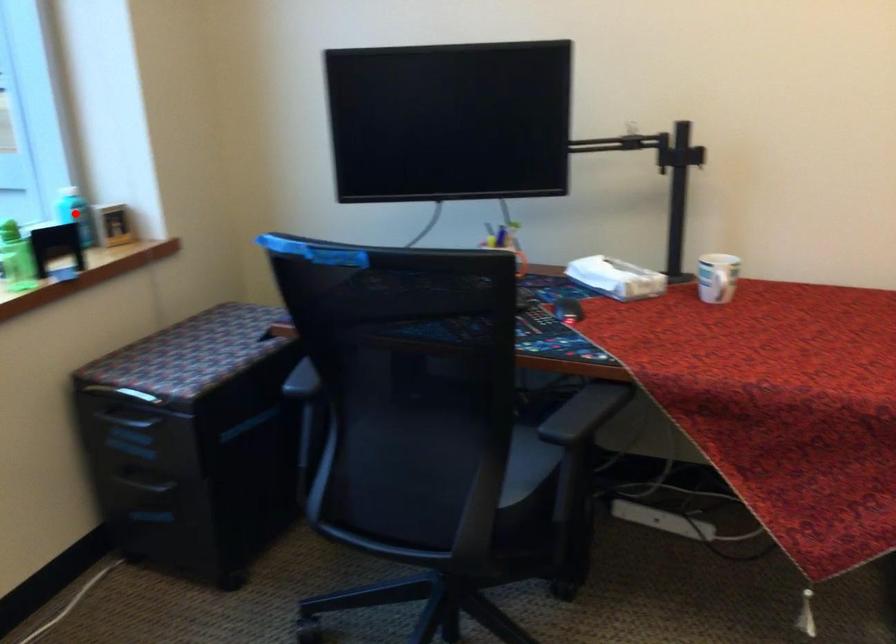
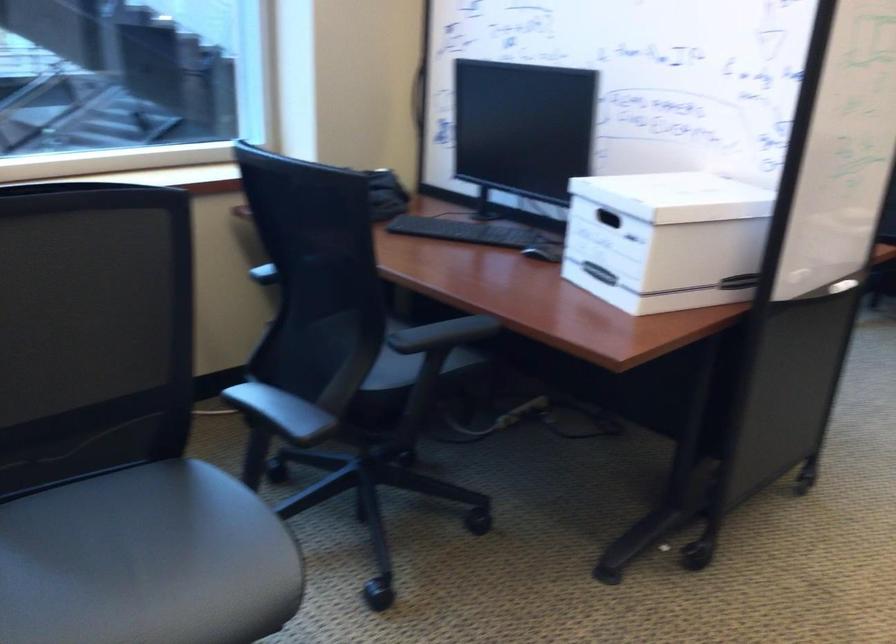
Question: I am providing you with two images of the same scene from different viewpoints. A red point is marked on the first image. At the location where the point appears in image 1, is it still visible in image 2?

Choices:
 (A) Yes
 (B) No

Answer: (B)